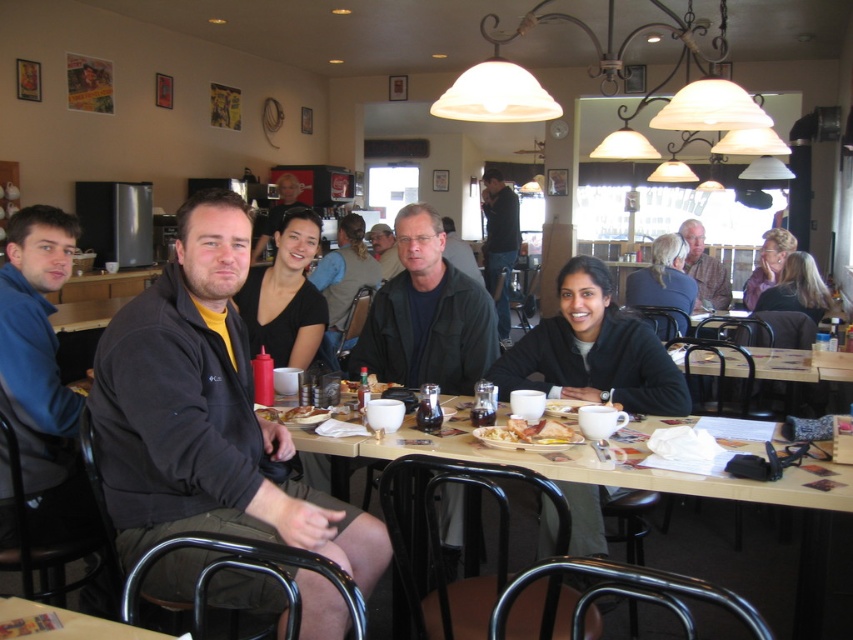
Can you confirm if golden crispy hash brown at center is positioned to the right of matte plastic sandwich at center?

Yes, golden crispy hash brown at center is to the right of matte plastic sandwich at center.

Can you confirm if golden crispy hash brown at center is positioned to the left of matte plastic sandwich at center?

Incorrect, golden crispy hash brown at center is not on the left side of matte plastic sandwich at center.

Does point (538, 428) come behind point (299, 413)?

No, (538, 428) is closer to viewer.

Find the location of a particular element. The height and width of the screenshot is (640, 853). golden crispy hash brown at center is located at coordinates [527, 433].

Between point (369, 449) and point (483, 248), which one is positioned in front?

Positioned in front is point (369, 449).

Who is more forward, (842,534) or (500,208)?

Point (842,534)

The width and height of the screenshot is (853, 640). Find the location of `wooden table at center`. wooden table at center is located at coordinates (677, 493).

Is blue fleece jacket at left bigger than dark brown hair at upper right?

Indeed, blue fleece jacket at left has a larger size compared to dark brown hair at upper right.

Which is more to the left, blue fleece jacket at left or dark brown hair at upper right?

Positioned to the left is blue fleece jacket at left.

What do you see at coordinates (41, 372) in the screenshot?
I see `blue fleece jacket at left` at bounding box center [41, 372].

Locate an element on the screen. blue fleece jacket at left is located at coordinates (41, 372).